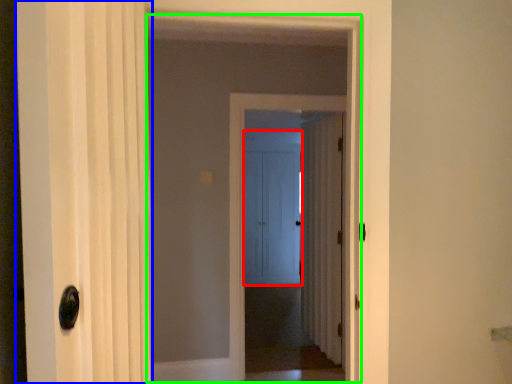
Question: Which object is the farthest from door (highlighted by a red box)? Choose among these: door (highlighted by a blue box) or elevator (highlighted by a green box).

Choices:
 (A) door
 (B) elevator

Answer: (A)